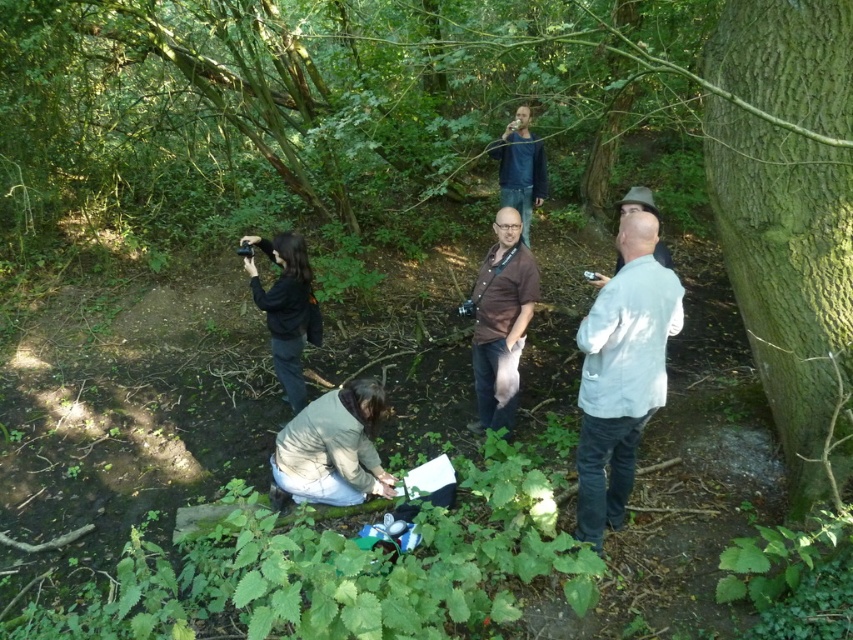
Question: Is black fabric camera at left positioned before brown fabric shirt at center?

Choices:
 (A) no
 (B) yes

Answer: (A)

Question: Which object is farther from the camera taking this photo?

Choices:
 (A) white cotton shirt at right
 (B) white cotton shirt at upper right
 (C) brown fabric shirt at center
 (D) smooth brown bark at right

Answer: (C)

Question: Does white cotton shirt at right come in front of blue denim jeans at upper center?

Choices:
 (A) no
 (B) yes

Answer: (B)

Question: Can you confirm if white cotton shirt at right is positioned to the right of light beige sweater at lower center?

Choices:
 (A) no
 (B) yes

Answer: (B)

Question: Considering the real-world distances, which object is closest to the white cotton shirt at right?

Choices:
 (A) smooth brown bark at right
 (B) blue denim jeans at upper center

Answer: (A)

Question: Based on their relative distances, which object is nearer to the white cotton shirt at right?

Choices:
 (A) blue denim jeans at upper center
 (B) white cotton shirt at upper right

Answer: (B)